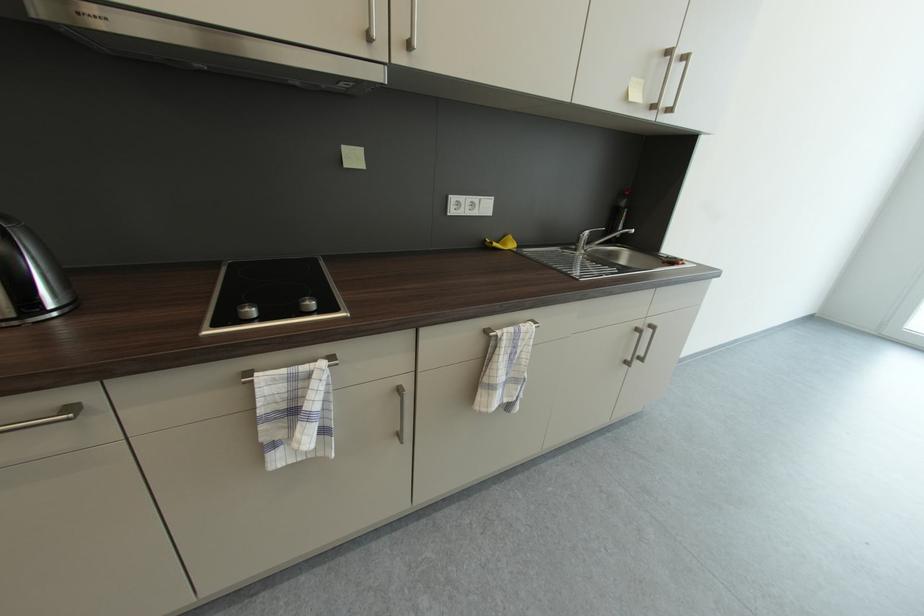
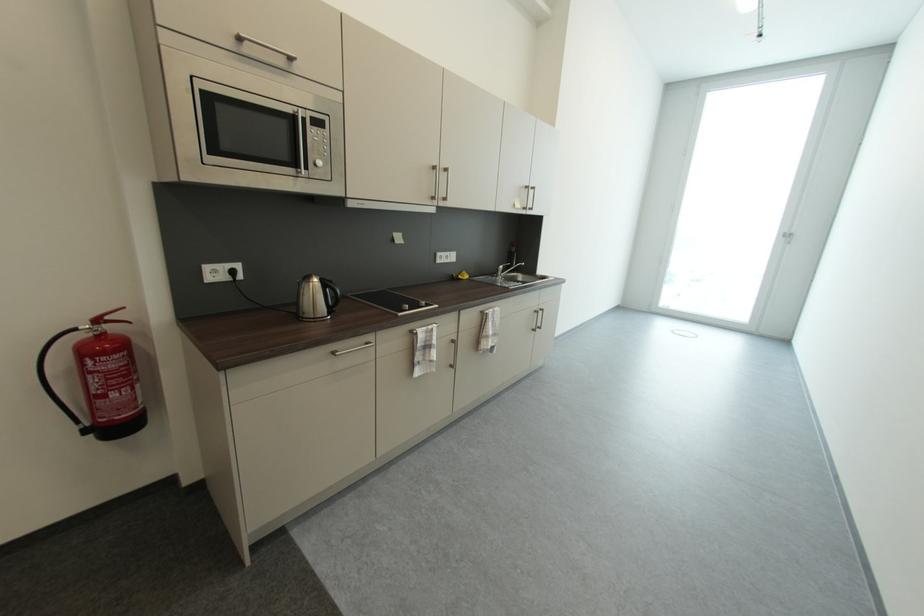
Where in the second image is the point corresponding to point (643, 331) from the first image?

(541, 313)